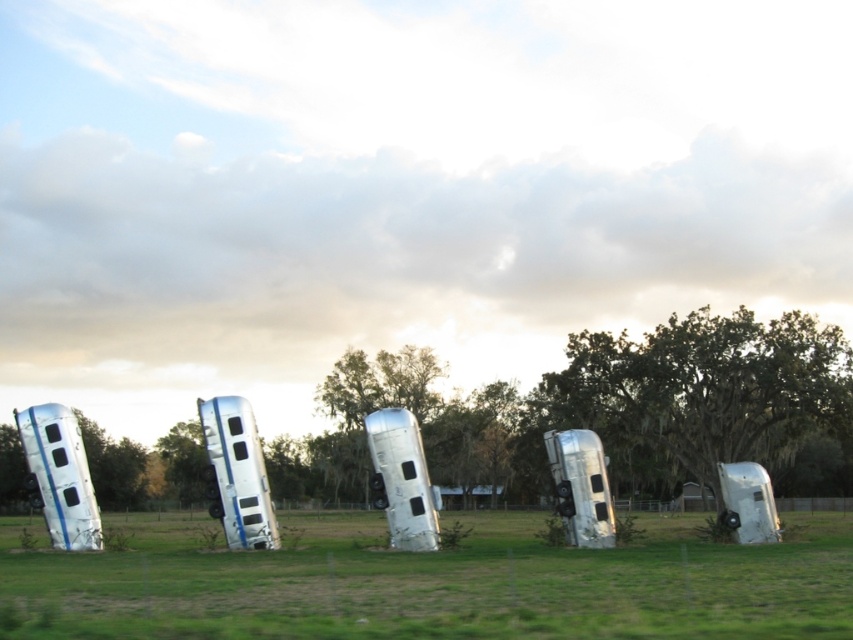
Does silver metallic bus at center have a smaller size compared to green leafy tree at center?

Actually, silver metallic bus at center might be larger than green leafy tree at center.

Does silver metallic bus at center have a larger size compared to green leafy tree at center?

Indeed, silver metallic bus at center has a larger size compared to green leafy tree at center.

Is point (3, 528) positioned before point (689, 403)?

No, it is behind (689, 403).

What are the coordinates of `silver metallic bus at center` in the screenshot? It's located at (428, 582).